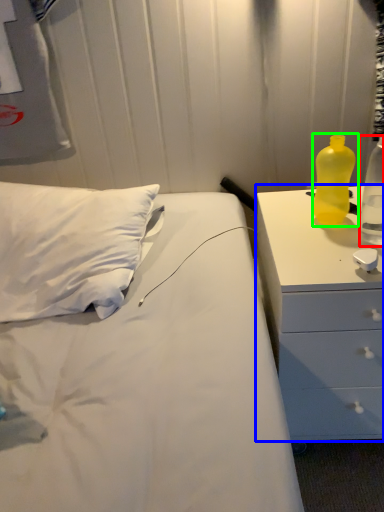
Question: Considering the real-world distances, which object is closest to bottle (highlighted by a red box)? chest of drawers (highlighted by a blue box) or bottle (highlighted by a green box).

Choices:
 (A) chest of drawers
 (B) bottle

Answer: (B)